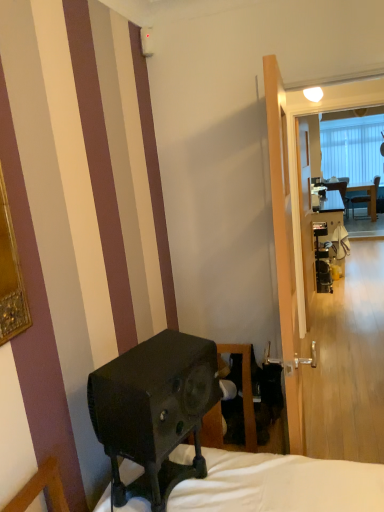
You are a GUI agent. You are given a task and a screenshot of the screen. Output one action in this format:
    pyautogui.click(x=<x>, y=<y>)
    Task: Click on the empty space that is ontop of black matte speaker at lower left (from a real-world perspective)
    
    Given the screenshot: What is the action you would take?
    pyautogui.click(x=155, y=353)